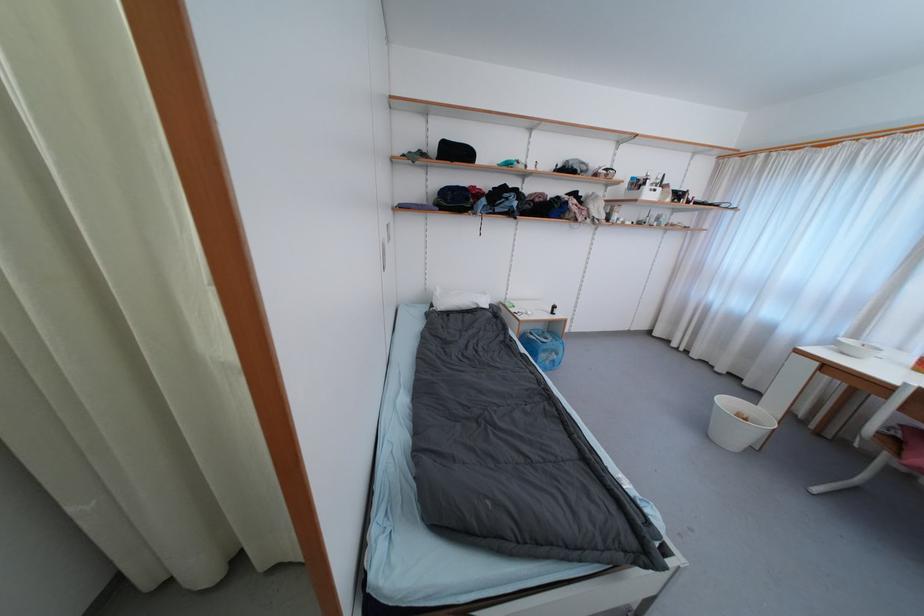
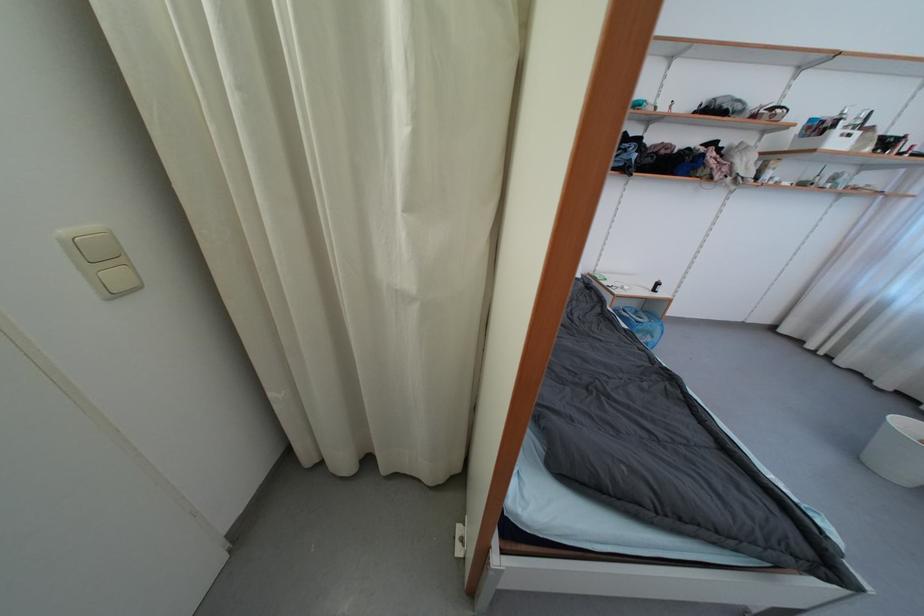
In the second image, find the point that corresponds to point 732,405 in the first image.

(912, 428)